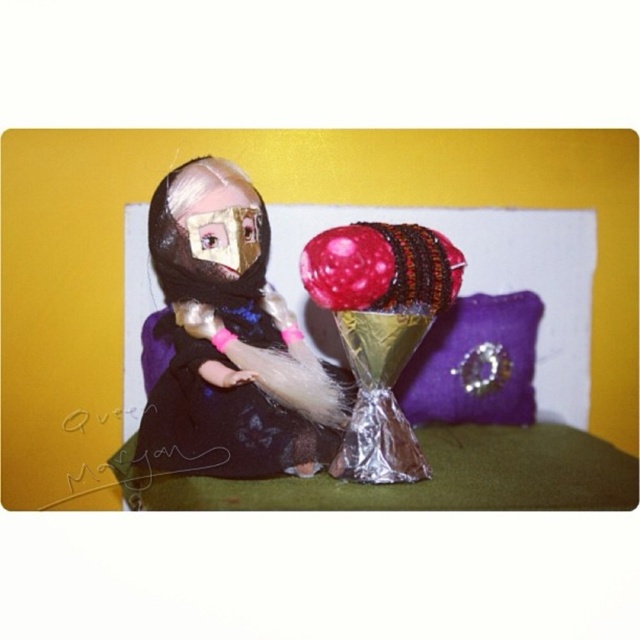
Question: Can you confirm if shiny metallic chocolate at center is positioned above velvet black dress at center?

Choices:
 (A) no
 (B) yes

Answer: (B)

Question: Among these points, which one is farthest from the camera?

Choices:
 (A) (444, 358)
 (B) (324, 237)
 (C) (508, 472)

Answer: (A)

Question: Can you confirm if shiny metallic chocolate at center is positioned below purple velvet pillow at center?

Choices:
 (A) yes
 (B) no

Answer: (B)

Question: Considering the real-world distances, which object is farthest from the velvet black dress at center?

Choices:
 (A) shiny metallic chocolate at center
 (B) purple velvet pillow at center
 (C) glossy plastic balloon at center
 (D) purple fabric bed at center

Answer: (B)

Question: Does purple velvet pillow at center have a larger size compared to glossy plastic balloon at center?

Choices:
 (A) no
 (B) yes

Answer: (B)

Question: Which point appears closest to the camera in this image?

Choices:
 (A) (328, 268)
 (B) (220, 435)

Answer: (A)